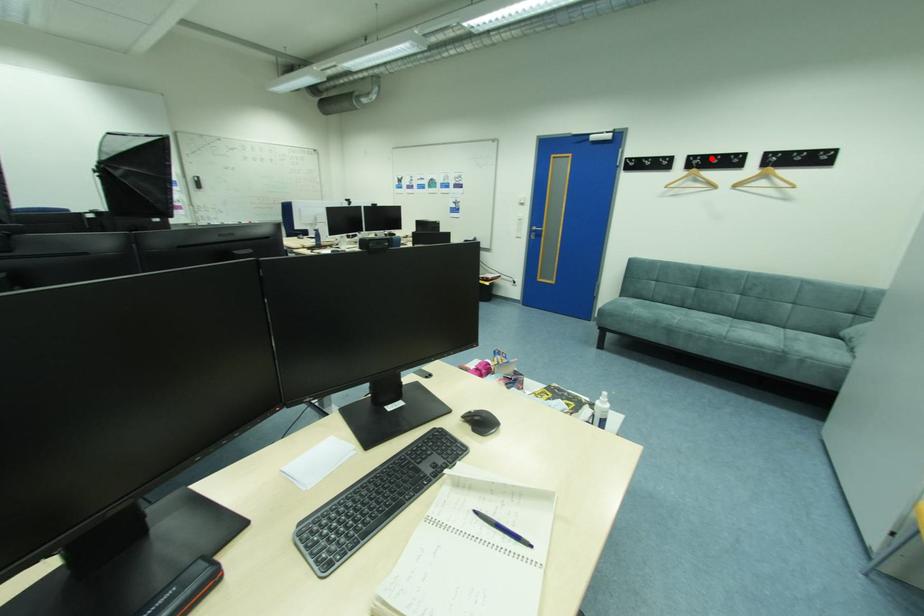
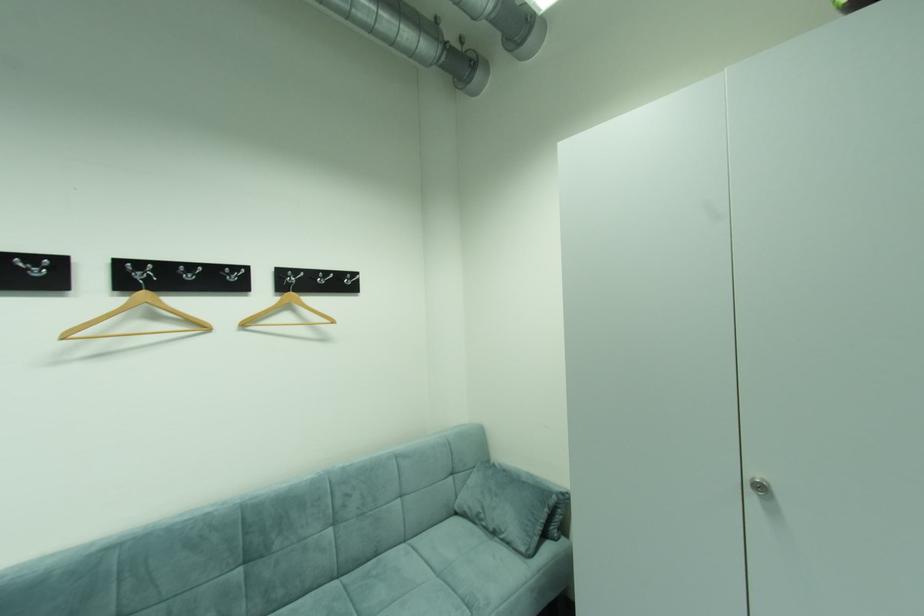
Where in the second image is the point corresponding to the highlighted location from the first image?

(172, 268)